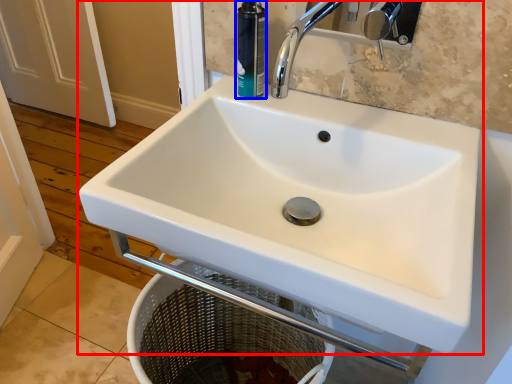
Question: Which point is further to the camera, sink (highlighted by a red box) or toiletry (highlighted by a blue box)?

Choices:
 (A) sink
 (B) toiletry

Answer: (B)